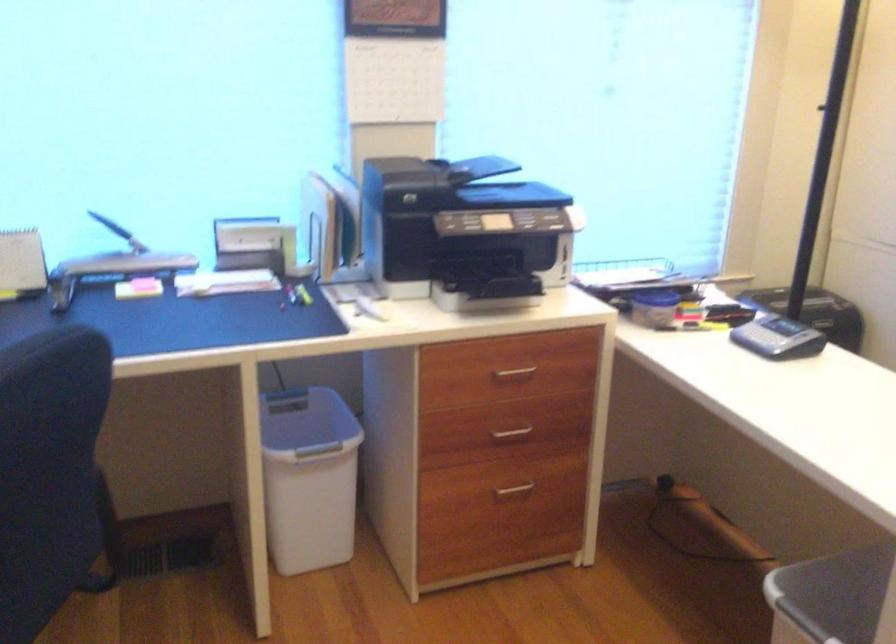
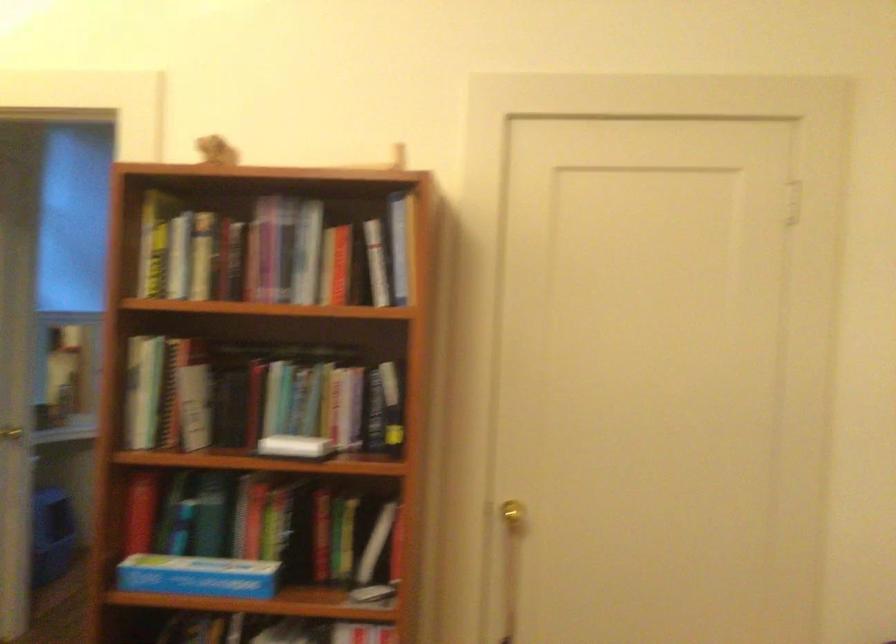
Question: The first image is from the beginning of the video and the second image is from the end. How did the camera likely rotate when shooting the video?

Choices:
 (A) Left
 (B) Right
 (C) Up
 (D) Down

Answer: (B)